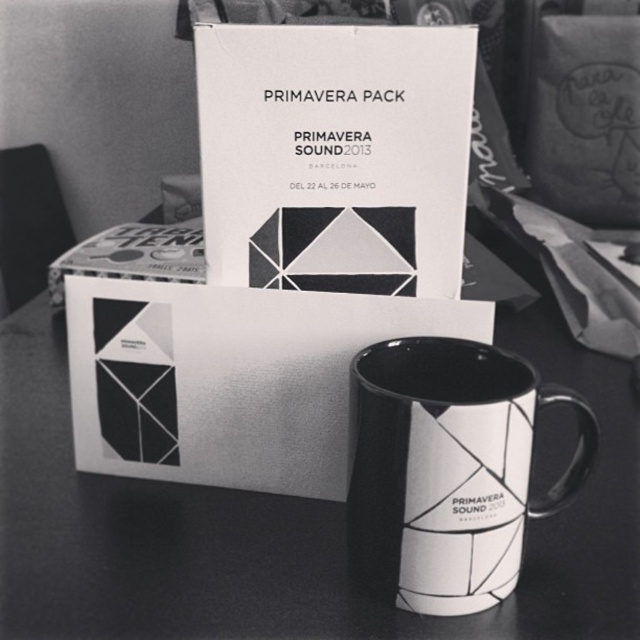
Can you confirm if white matte cardboard box at center is taller than white glossy mug at lower center?

Yes.

Who is shorter, white matte cardboard box at center or white glossy mug at lower center?

white glossy mug at lower center is shorter.

Who is more forward, [284,204] or [532,413]?

Result: Point [532,413] is more forward.

Locate an element on the screen. This screenshot has width=640, height=640. white matte cardboard box at center is located at coordinates (333, 156).

Measure the distance between white glossy mug at center and camera.

A distance of 18.45 inches exists between white glossy mug at center and camera.

Is white glossy mug at center below white matte cardboard box at center?

Yes.

Does point (36, 368) come farther from viewer compared to point (330, 38)?

That is True.

This screenshot has height=640, width=640. Identify the location of white glossy mug at center. (284, 520).

Is white glossy mug at center thinner than white glossy mug at lower center?

No.

Is white glossy mug at center taller than white glossy mug at lower center?

Indeed, white glossy mug at center has a greater height compared to white glossy mug at lower center.

Who is more forward, (x=600, y=605) or (x=365, y=532)?

Point (x=365, y=532) is more forward.

At what (x,y) coordinates should I click in order to perform the action: click on white glossy mug at center. Please return your answer as a coordinate pair (x, y). The width and height of the screenshot is (640, 640). Looking at the image, I should click on (284, 520).